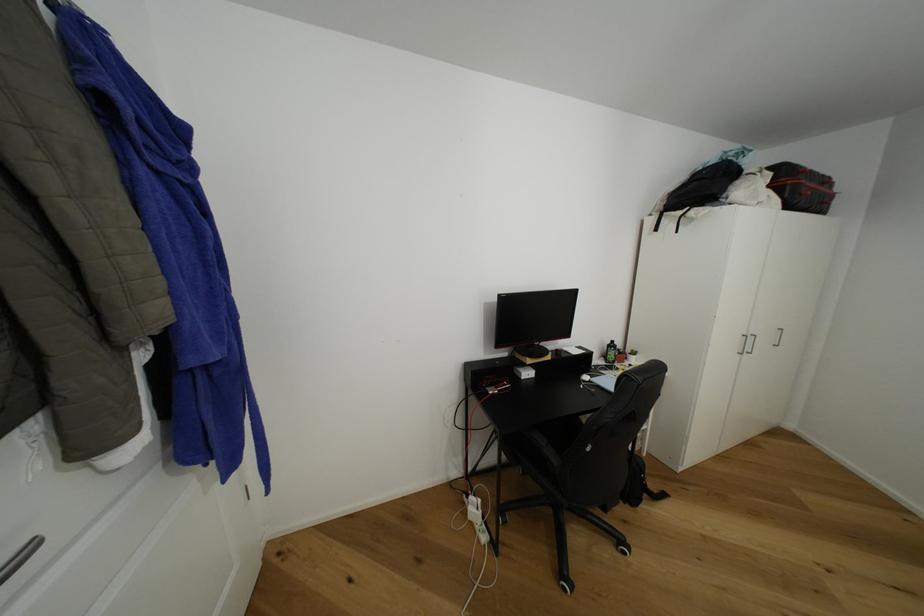
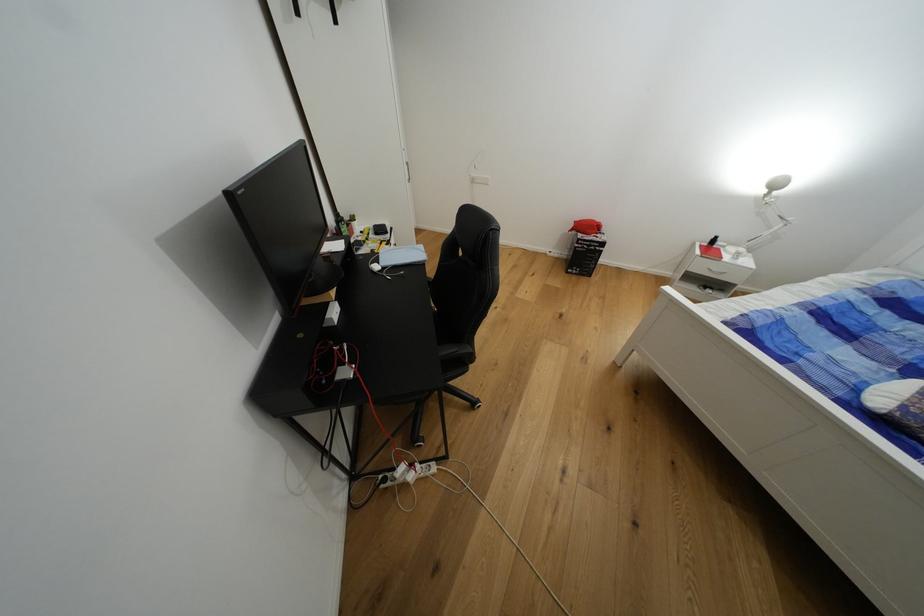
Where in the second image is the point corresponding to (x=549, y=446) from the first image?

(460, 351)